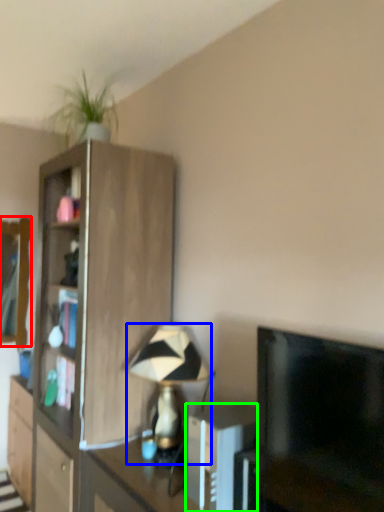
Question: Considering the real-world distances, which object is farthest from mirror (highlighted by a red box)? table lamp (highlighted by a blue box) or appliance (highlighted by a green box)?

Choices:
 (A) table lamp
 (B) appliance

Answer: (B)